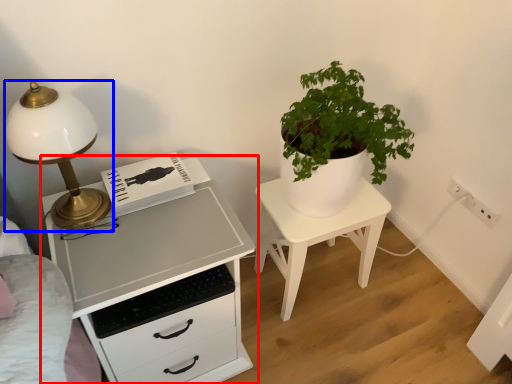
Question: Which object is further to the camera taking this photo, chest of drawers (highlighted by a red box) or lamp (highlighted by a blue box)?

Choices:
 (A) chest of drawers
 (B) lamp

Answer: (A)